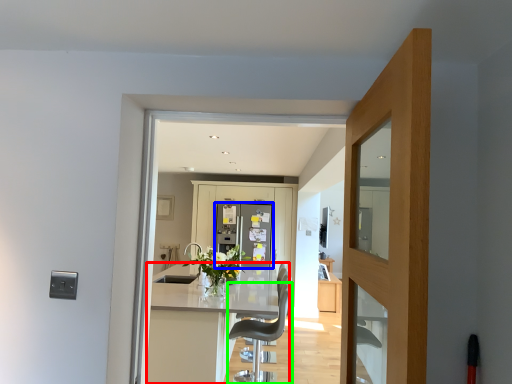
Question: Which object is the farthest from kitchen & dining room table (highlighted by a red box)? Choose among these: refrigerator (highlighted by a blue box) or chair (highlighted by a green box).

Choices:
 (A) refrigerator
 (B) chair

Answer: (A)